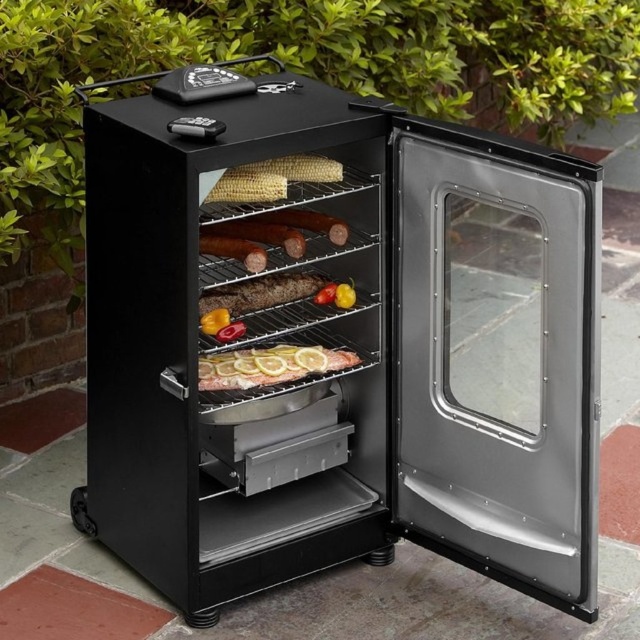
Question: Is slightly translucent glass fish at center above yellow matte corn at upper center?

Choices:
 (A) no
 (B) yes

Answer: (A)

Question: Which point is closer to the camera?

Choices:
 (A) yellow matte corn at upper center
 (B) smokey brown sausage at center

Answer: (A)

Question: From the image, what is the correct spatial relationship of yellow matte corn at upper center in relation to smokey brown sausage at center?

Choices:
 (A) left
 (B) right

Answer: (B)

Question: Estimate the real-world distances between objects in this image. Which object is farther from the slightly translucent glass fish at center?

Choices:
 (A) yellow matte corn at upper center
 (B) smokey brown sausage at center

Answer: (A)

Question: Which point is farther to the camera?

Choices:
 (A) (211, 358)
 (B) (212, 193)

Answer: (A)

Question: Is slightly translucent glass fish at center in front of smokey brown sausage at center?

Choices:
 (A) no
 (B) yes

Answer: (A)